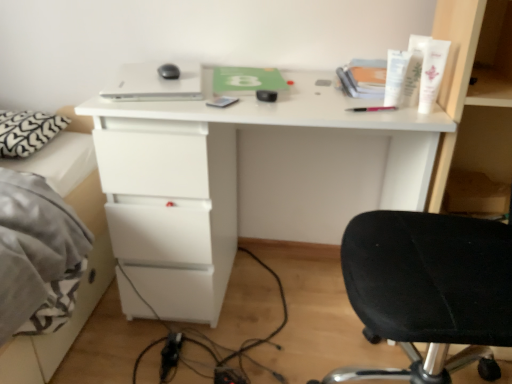
Locate an element on the screen. free space on the front side of white cream tube at upper right, which is counted as the first toiletry, starting from the left is located at coordinates (400, 113).